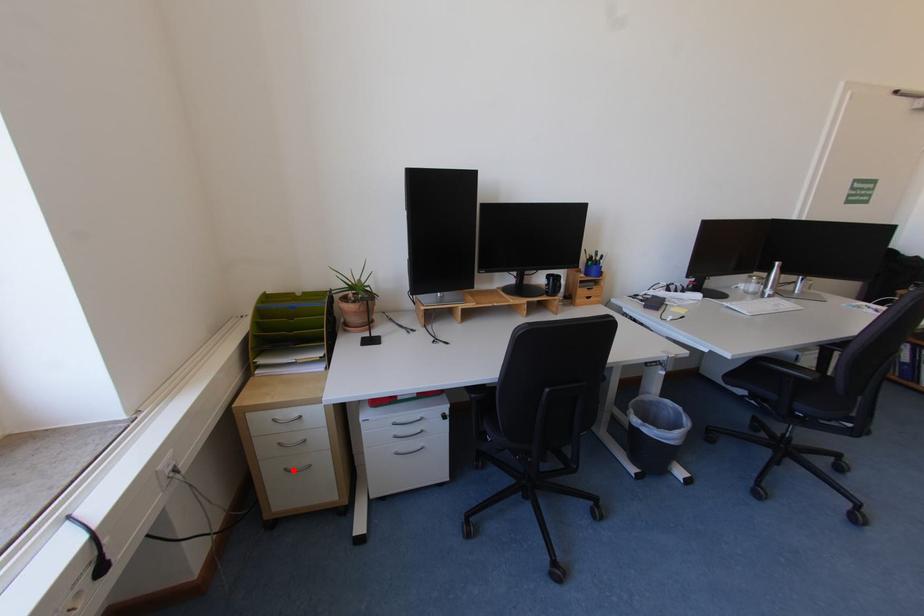
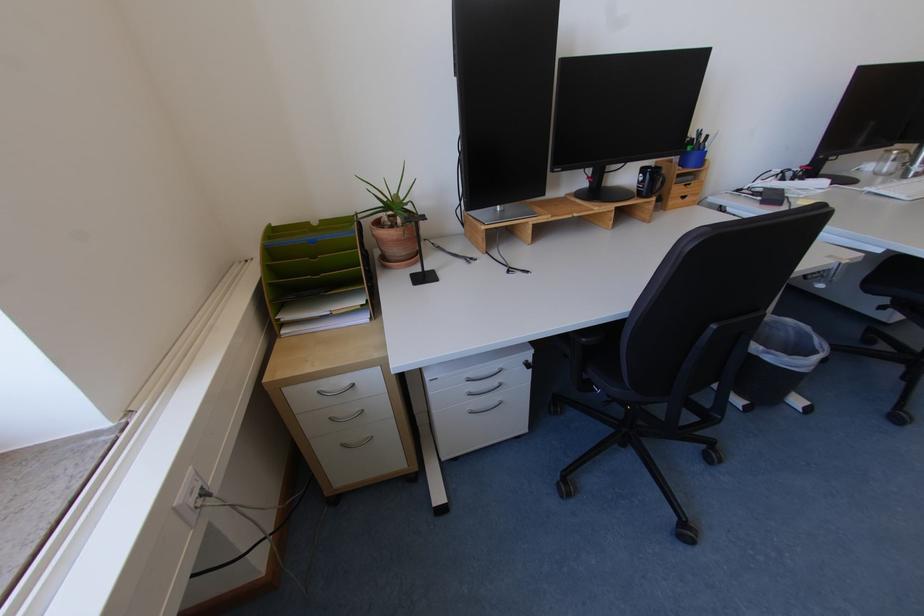
Where in the second image is the point corresponding to the highlighted location from the first image?

(350, 446)